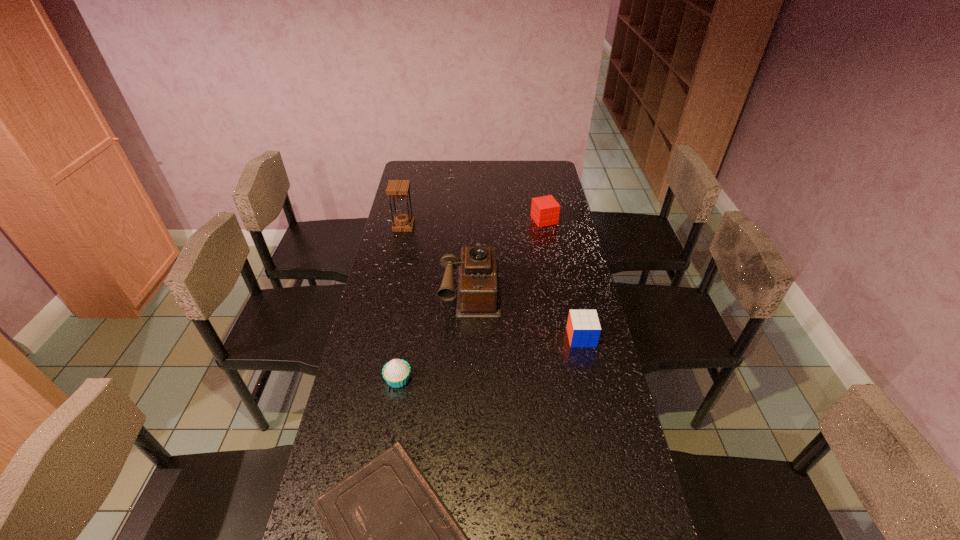
I want to click on free region located on the front of the third nearest object, so click(597, 411).

This screenshot has width=960, height=540. I want to click on hourglass that is at the left edge, so click(x=403, y=222).

Identify the location of cupcake that is at the left edge. The height and width of the screenshot is (540, 960). (396, 372).

The width and height of the screenshot is (960, 540). In order to click on free space at the far edge of the desktop in this screenshot , I will do `click(517, 181)`.

In the image, there is a desktop. What are the coordinates of `vacant space at the left edge` in the screenshot? It's located at (382, 382).

Where is `vacant space at the right edge of the desktop`? vacant space at the right edge of the desktop is located at coordinates (568, 293).

Identify the location of vacant point located between the farther cube and the fourth nearest object. This screenshot has height=540, width=960. (508, 254).

Image resolution: width=960 pixels, height=540 pixels. I want to click on vacant area that lies between the second tallest object and the nearer cube, so click(x=526, y=313).

In order to click on vacant point located between the second nearest object and the third nearest object in this screenshot , I will do `click(490, 358)`.

At what (x,y) coordinates should I click in order to perform the action: click on vacant space that's between the farther cube and the third farthest object. Please return your answer as a coordinate pair (x, y). Looking at the image, I should click on (508, 254).